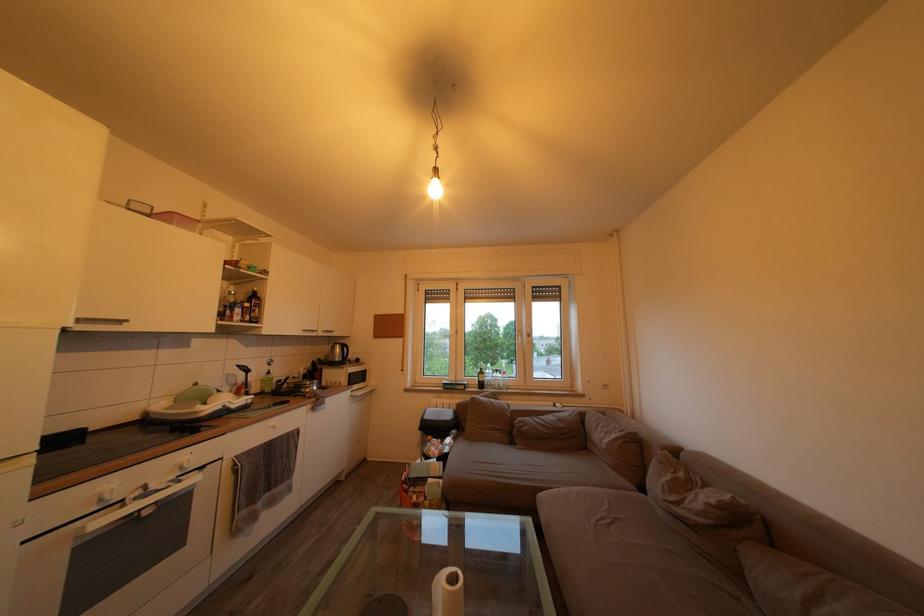
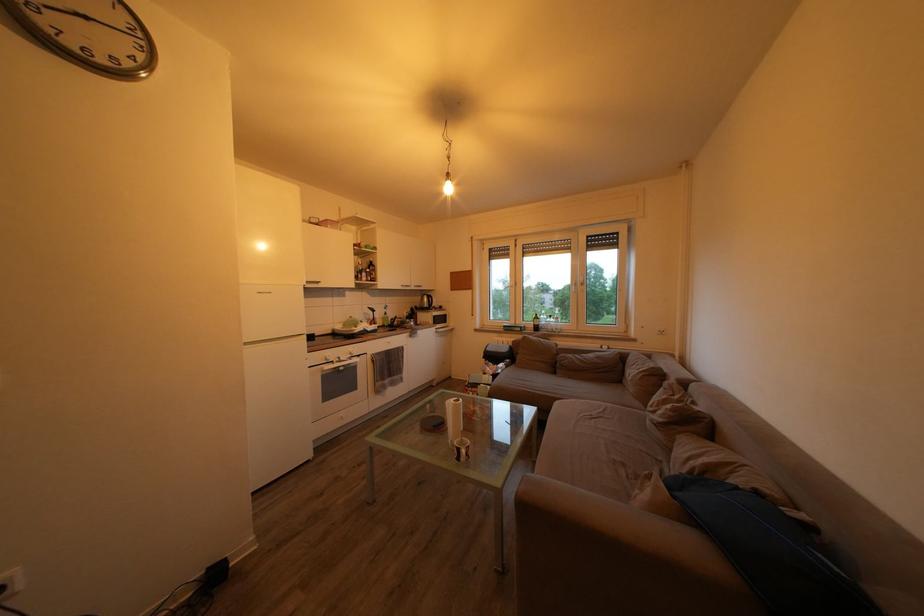
In a continuous first-person perspective shot, in which direction is the camera moving?

The movement direction of the cameraman is right, backward.